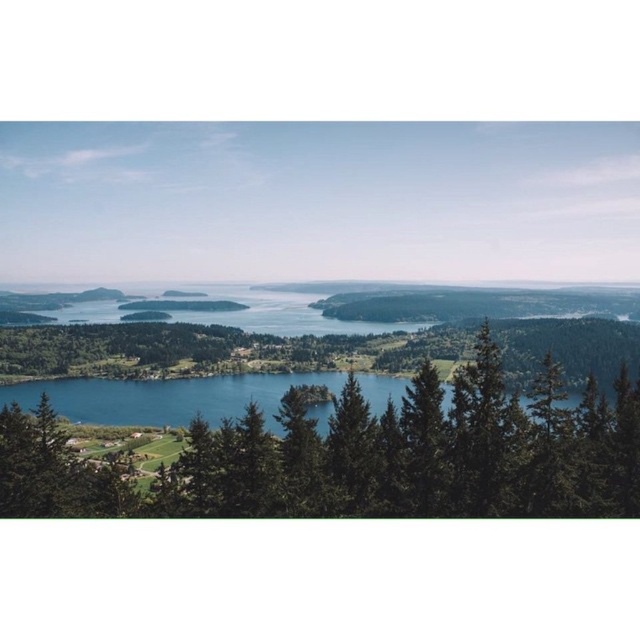
Question: Is green textured tree at center bigger than blue water at center?

Choices:
 (A) yes
 (B) no

Answer: (A)

Question: Which point is closer to the camera?

Choices:
 (A) blue water at center
 (B) green textured tree at center

Answer: (B)

Question: Where is green textured tree at center located in relation to blue water at center in the image?

Choices:
 (A) below
 (B) above

Answer: (B)

Question: From the image, what is the correct spatial relationship of green textured tree at center in relation to blue water at center?

Choices:
 (A) above
 (B) below

Answer: (A)

Question: Which object appears closest to the camera in this image?

Choices:
 (A) green textured tree at center
 (B) blue water at center

Answer: (A)